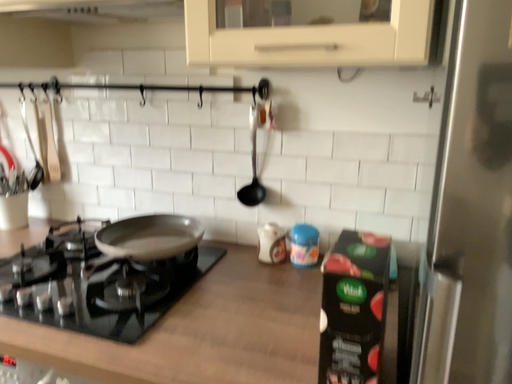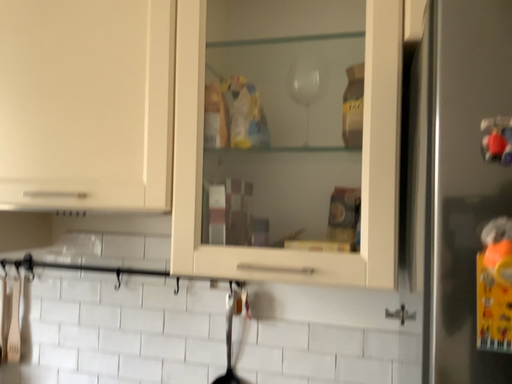
Question: Which way did the camera rotate in the video?

Choices:
 (A) rotated downward
 (B) rotated upward

Answer: (B)